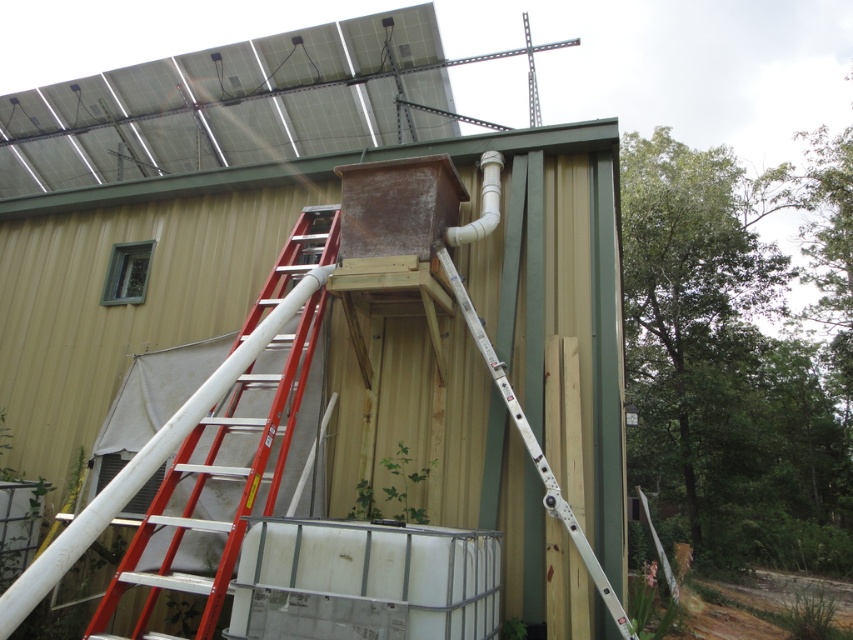
Based on the photo, which is more to the right, rusty metal box at center or white plastic pipe at upper right?

white plastic pipe at upper right

Can you confirm if rusty metal box at center is positioned above white plastic pipe at upper right?

Correct, rusty metal box at center is located above white plastic pipe at upper right.

Who is more forward, (x=248, y=308) or (x=482, y=208)?

Point (x=482, y=208) is in front.

This screenshot has width=853, height=640. In order to click on rusty metal box at center in this screenshot , I will do `click(331, 294)`.

Can you confirm if rusty metal box at center is bigger than red metallic ladder at left?

No.

Is point (525, 285) positioned in front of point (225, 472)?

No, (525, 285) is further to viewer.

Does point (469, 145) lie in front of point (183, 451)?

That is False.

This screenshot has height=640, width=853. In order to click on rusty metal box at center in this screenshot , I will do `click(331, 294)`.

Is red metallic ladder at left thinner than white plastic pipe at upper right?

Incorrect, red metallic ladder at left's width is not less than white plastic pipe at upper right's.

Does red metallic ladder at left appear on the right side of white plastic pipe at upper right?

Incorrect, red metallic ladder at left is not on the right side of white plastic pipe at upper right.

Find the location of a particular element. The height and width of the screenshot is (640, 853). red metallic ladder at left is located at coordinates (218, 484).